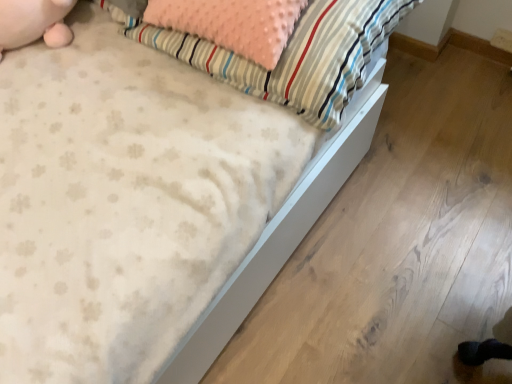
Describe the element at coordinates (34, 22) in the screenshot. I see `pink plush toy at upper left` at that location.

At what (x,y) coordinates should I click in order to perform the action: click on pink plush toy at upper left. Please return your answer as a coordinate pair (x, y). Looking at the image, I should click on (34, 22).

Measure the distance between point [38,34] and camera.

The distance of point [38,34] from camera is 95.60 centimeters.

Locate an element on the screen. This screenshot has height=384, width=512. fluffy pink pillow at upper center is located at coordinates (289, 54).

The image size is (512, 384). What do you see at coordinates (289, 54) in the screenshot?
I see `fluffy pink pillow at upper center` at bounding box center [289, 54].

You are a GUI agent. You are given a task and a screenshot of the screen. Output one action in this format:
    pyautogui.click(x=<x>, y=<y>)
    Task: Click on the pink plush toy at upper left
    The height and width of the screenshot is (384, 512).
    Given the screenshot: What is the action you would take?
    (34, 22)

Is pink plush toy at upper left to the left of fluffy pink pillow at upper center from the viewer's perspective?

Yes, pink plush toy at upper left is to the left of fluffy pink pillow at upper center.

Which object is more forward, pink plush toy at upper left or fluffy pink pillow at upper center?

fluffy pink pillow at upper center is more forward.

Considering the positions of point (29, 0) and point (307, 118), is point (29, 0) closer or farther from the camera than point (307, 118)?

Point (29, 0) appears to be farther away from the viewer than point (307, 118).

From the image's perspective, relative to fluffy pink pillow at upper center, is pink plush toy at upper left above or below?

Based on their image positions, pink plush toy at upper left is located above fluffy pink pillow at upper center.

From a real-world perspective, which is physically below, pink plush toy at upper left or fluffy pink pillow at upper center?

fluffy pink pillow at upper center.

Between pink plush toy at upper left and fluffy pink pillow at upper center, which one has larger width?

Wider between the two is fluffy pink pillow at upper center.

Can you confirm if pink plush toy at upper left is taller than fluffy pink pillow at upper center?

No.

Considering the sizes of objects pink plush toy at upper left and fluffy pink pillow at upper center in the image provided, who is bigger, pink plush toy at upper left or fluffy pink pillow at upper center?

fluffy pink pillow at upper center.

Would you say pink plush toy at upper left contains fluffy pink pillow at upper center?

No, fluffy pink pillow at upper center is not surrounded by pink plush toy at upper left.

Is pink plush toy at upper left in contact with fluffy pink pillow at upper center?

pink plush toy at upper left is not next to fluffy pink pillow at upper center, and they're not touching.

Is pink plush toy at upper left turned away from fluffy pink pillow at upper center?

No, pink plush toy at upper left is not facing the opposite direction of fluffy pink pillow at upper center.

What's the angular difference between pink plush toy at upper left and fluffy pink pillow at upper center's facing directions?

63.5 degrees.

Identify the location of animal above the fluffy pink pillow at upper center (from a real-world perspective). (34, 22).

Considering the positions of objects fluffy pink pillow at upper center and pink plush toy at upper left in the image provided, who is more to the right, fluffy pink pillow at upper center or pink plush toy at upper left?

fluffy pink pillow at upper center.

Considering the relative positions of fluffy pink pillow at upper center and pink plush toy at upper left in the image provided, is fluffy pink pillow at upper center behind pink plush toy at upper left?

No, fluffy pink pillow at upper center is closer to the viewer.

Between point (254, 95) and point (31, 22), which one is positioned behind?

The point (31, 22) is behind.

From the image's perspective, who appears lower, fluffy pink pillow at upper center or pink plush toy at upper left?

From the image's view, fluffy pink pillow at upper center is below.

From a real-world perspective, is fluffy pink pillow at upper center positioned under pink plush toy at upper left based on gravity?

Correct, in the physical world, fluffy pink pillow at upper center is lower than pink plush toy at upper left.

Looking at their sizes, would you say fluffy pink pillow at upper center is wider or thinner than pink plush toy at upper left?

fluffy pink pillow at upper center is wider than pink plush toy at upper left.

Considering the sizes of objects fluffy pink pillow at upper center and pink plush toy at upper left in the image provided, who is taller, fluffy pink pillow at upper center or pink plush toy at upper left?

fluffy pink pillow at upper center is taller.

Considering the sizes of fluffy pink pillow at upper center and pink plush toy at upper left in the image, is fluffy pink pillow at upper center bigger or smaller than pink plush toy at upper left?

In the image, fluffy pink pillow at upper center appears to be larger than pink plush toy at upper left.

Is pink plush toy at upper left surrounded by fluffy pink pillow at upper center?

No, pink plush toy at upper left is not surrounded by fluffy pink pillow at upper center.

Are fluffy pink pillow at upper center and pink plush toy at upper left beside each other?

No.

Is fluffy pink pillow at upper center looking in the opposite direction of pink plush toy at upper left?

That's not correct — fluffy pink pillow at upper center is not looking away from pink plush toy at upper left.

The image size is (512, 384). What are the coordinates of `animal above the fluffy pink pillow at upper center (from the image's perspective)` in the screenshot? It's located at (34, 22).

In the image, there is a fluffy pink pillow at upper center. Identify the location of animal above it (from the image's perspective). The image size is (512, 384). (34, 22).

Identify the location of animal that appears on the left of fluffy pink pillow at upper center. This screenshot has height=384, width=512. (34, 22).